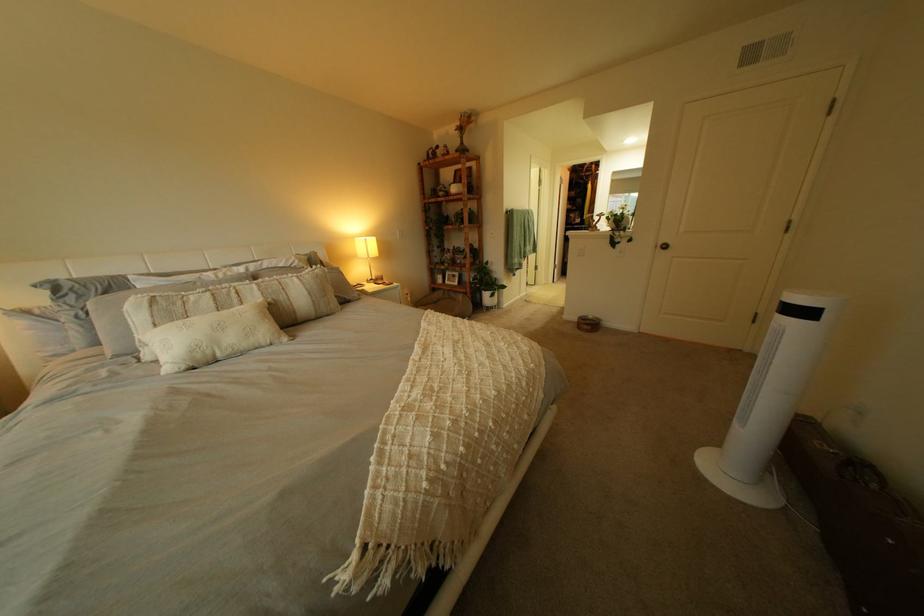
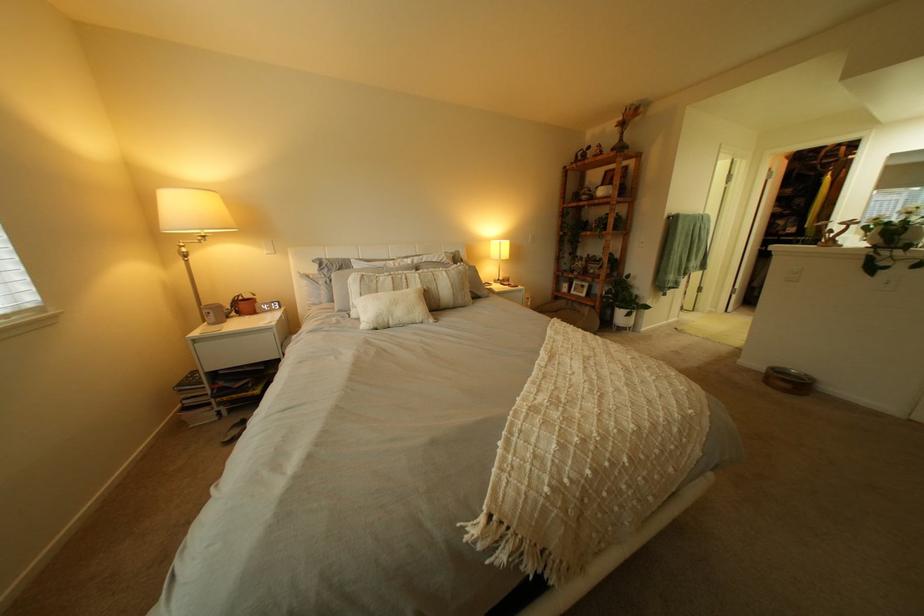
Question: The camera is either moving clockwise (left) or counter-clockwise (right) around the object. The first image is from the beginning of the video and the second image is from the end. Is the camera moving left or right when shooting the video?

Choices:
 (A) Left
 (B) Right

Answer: (B)